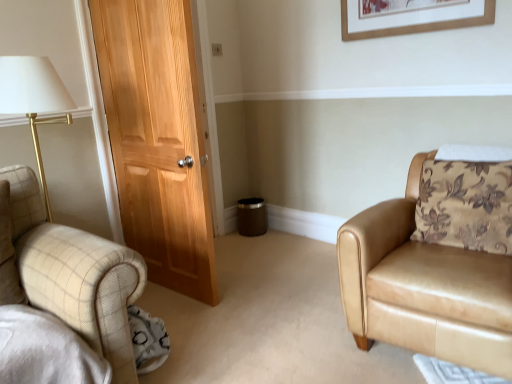
Question: Is tan leather armchair at right outside wooden picture frame at upper center?

Choices:
 (A) no
 (B) yes

Answer: (B)

Question: From the image's perspective, is tan leather armchair at right above wooden picture frame at upper center?

Choices:
 (A) yes
 (B) no

Answer: (B)

Question: Is the position of tan leather armchair at right more distant than that of wooden picture frame at upper center?

Choices:
 (A) yes
 (B) no

Answer: (B)

Question: From a real-world perspective, is tan leather armchair at right on wooden picture frame at upper center?

Choices:
 (A) no
 (B) yes

Answer: (A)

Question: Considering the relative sizes of tan leather armchair at right and wooden picture frame at upper center in the image provided, is tan leather armchair at right wider than wooden picture frame at upper center?

Choices:
 (A) no
 (B) yes

Answer: (B)

Question: From the image's perspective, is tan leather armchair at right below wooden picture frame at upper center?

Choices:
 (A) no
 (B) yes

Answer: (B)

Question: Is wooden picture frame at upper center positioned with its back to tan leather armchair at right?

Choices:
 (A) yes
 (B) no

Answer: (B)

Question: Considering the relative sizes of wooden picture frame at upper center and tan leather armchair at right in the image provided, is wooden picture frame at upper center taller than tan leather armchair at right?

Choices:
 (A) yes
 (B) no

Answer: (B)

Question: Can you confirm if wooden picture frame at upper center is shorter than tan leather armchair at right?

Choices:
 (A) yes
 (B) no

Answer: (A)

Question: Is wooden picture frame at upper center far away from tan leather armchair at right?

Choices:
 (A) yes
 (B) no

Answer: (A)

Question: From the image's perspective, is wooden picture frame at upper center under tan leather armchair at right?

Choices:
 (A) yes
 (B) no

Answer: (B)

Question: Is tan leather armchair at right completely or partially inside wooden picture frame at upper center?

Choices:
 (A) no
 (B) yes

Answer: (A)

Question: Based on their sizes in the image, would you say wooden picture frame at upper center is bigger or smaller than tan leather armchair at right?

Choices:
 (A) big
 (B) small

Answer: (B)